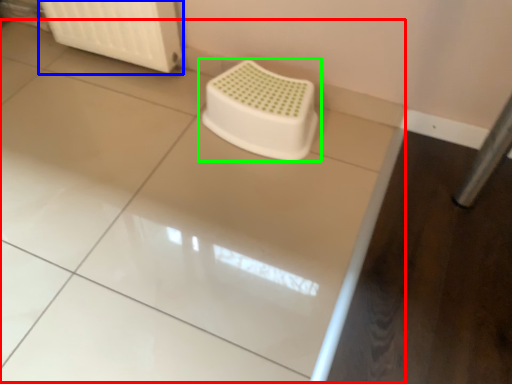
Question: Estimate the real-world distances between objects in this image. Which object is farther from counter top (highlighted by a red box), radiator (highlighted by a blue box) or toilet (highlighted by a green box)?

Choices:
 (A) radiator
 (B) toilet

Answer: (A)